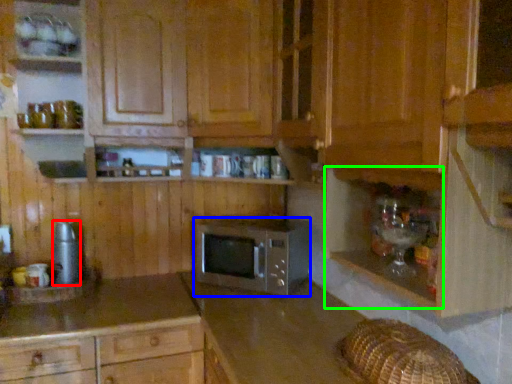
Question: Based on their relative distances, which object is farther from appliance (highlighted by a red box)? Choose from microwave oven (highlighted by a blue box) and shelf (highlighted by a green box).

Choices:
 (A) microwave oven
 (B) shelf

Answer: (B)